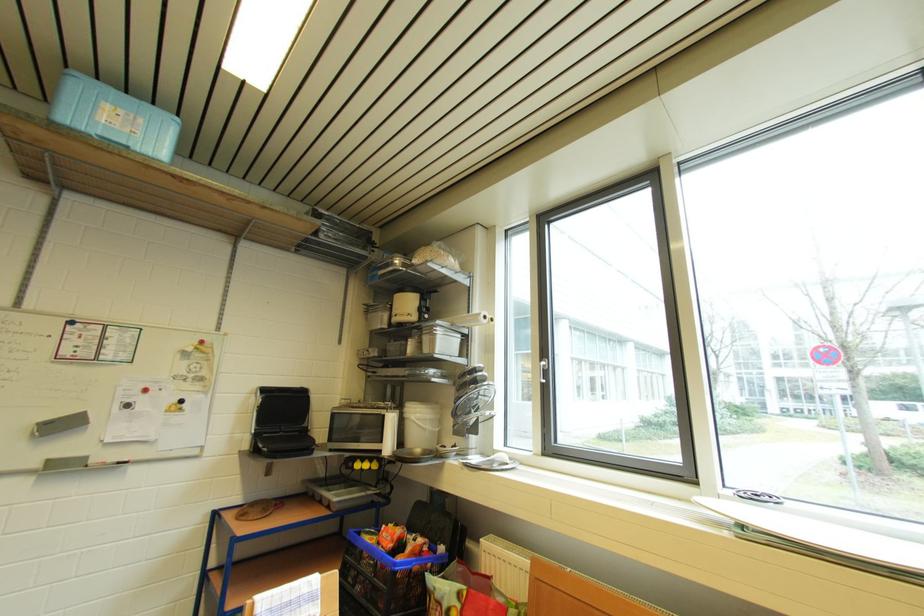
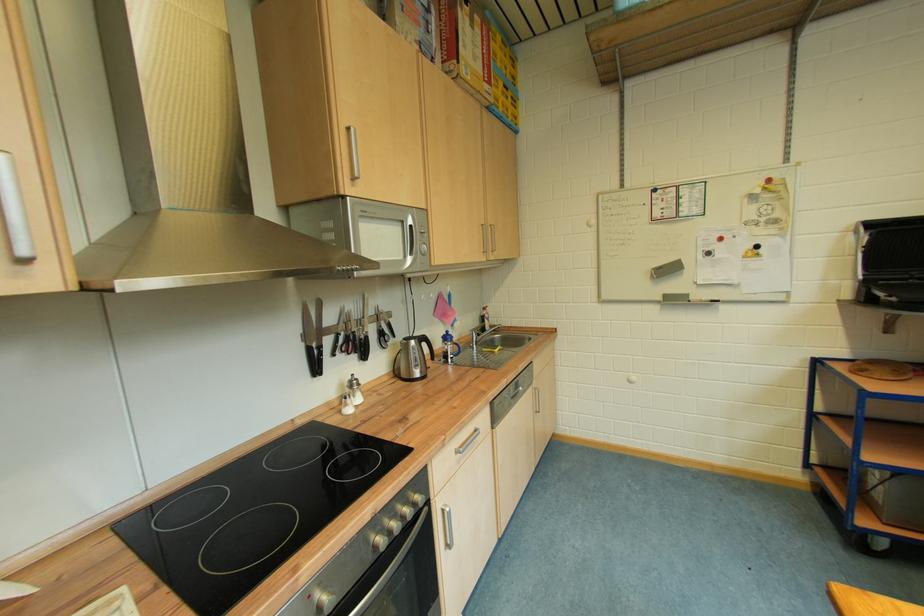
Locate, in the second image, the point that corresponds to the point at 249,522 in the first image.

(868, 377)